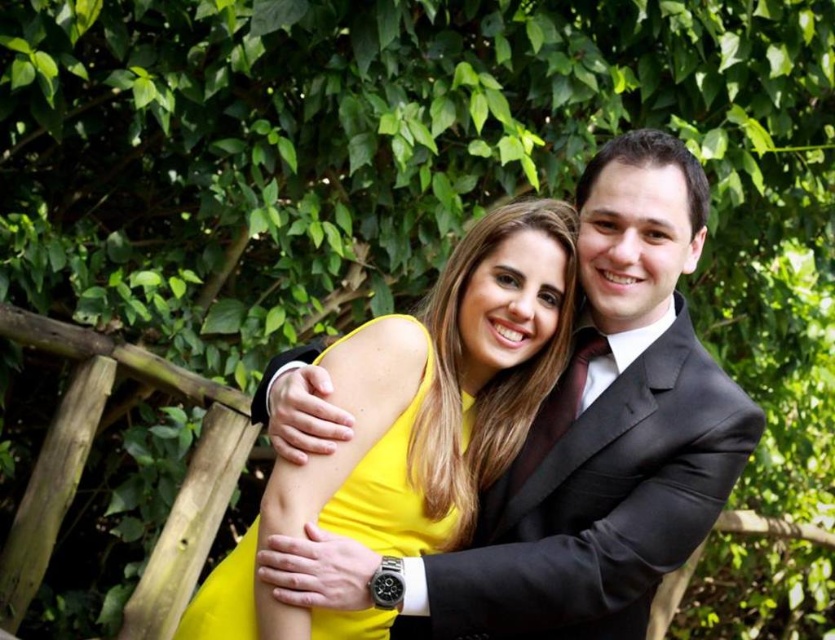
Image resolution: width=835 pixels, height=640 pixels. What are the coordinates of `shiny black suit at center` in the screenshot? It's located at (605, 433).

Which is above, shiny black suit at center or yellow satin dress at center?

shiny black suit at center is higher up.

The width and height of the screenshot is (835, 640). What are the coordinates of `shiny black suit at center` in the screenshot? It's located at (605, 433).

Between shiny black suit at center and satin black suit at center, which one has more height?

shiny black suit at center is taller.

The height and width of the screenshot is (640, 835). What do you see at coordinates (605, 433) in the screenshot?
I see `shiny black suit at center` at bounding box center [605, 433].

Image resolution: width=835 pixels, height=640 pixels. Identify the location of shiny black suit at center. (605, 433).

From the picture: Can you confirm if satin black suit at center is thinner than yellow satin dress at center?

No, satin black suit at center is not thinner than yellow satin dress at center.

Is satin black suit at center further to camera compared to yellow satin dress at center?

That is True.

Who is more forward, (633,605) or (367,516)?

Positioned in front is point (367,516).

Find the location of a particular element. The height and width of the screenshot is (640, 835). satin black suit at center is located at coordinates (600, 508).